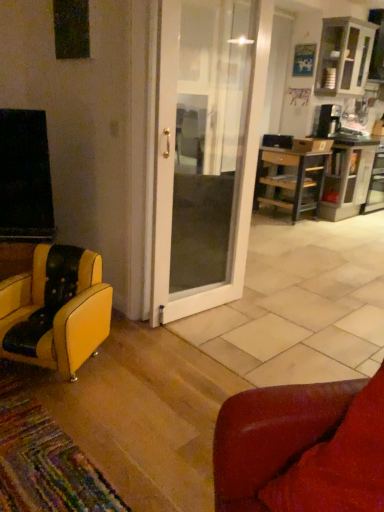
Identify the location of vacant space to the right of yellow leather chair at lower left, which is the 2th chair from front to back. (143, 373).